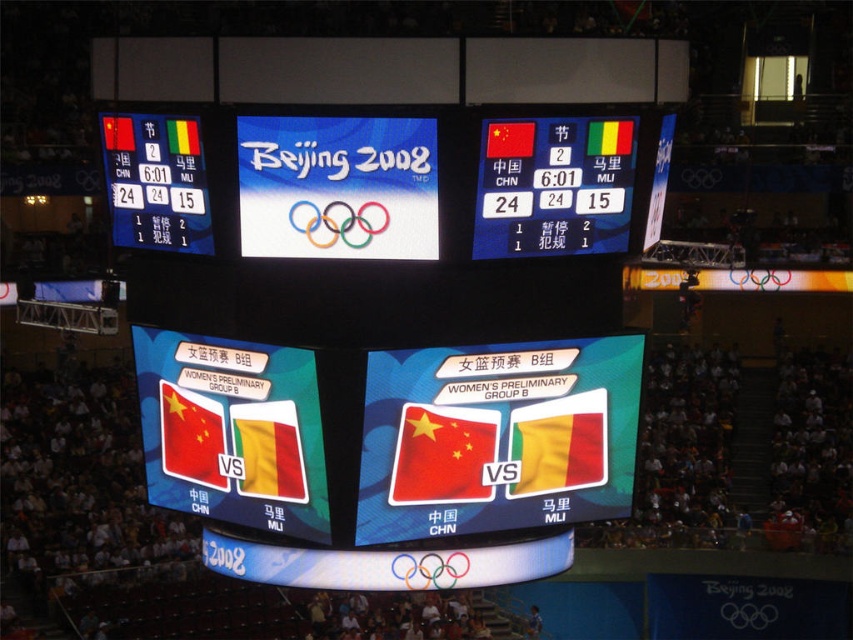
Question: Among these points, which one is farthest from the camera?

Choices:
 (A) (553, 445)
 (B) (239, 436)

Answer: (A)

Question: Based on their relative distances, which object is nearer to the red matte flag at lower left?

Choices:
 (A) red matte flag at center
 (B) yellow fabric flag at center
 (C) matte black scoreboard at upper left

Answer: (A)

Question: Does matte plastic scoreboard at upper center come in front of yellow fabric flag at center?

Choices:
 (A) no
 (B) yes

Answer: (B)

Question: Is white paper at center smaller than yellow fabric flag at center?

Choices:
 (A) yes
 (B) no

Answer: (A)

Question: Does matte plastic scoreboard at upper center appear on the right side of red fabric flag at center?

Choices:
 (A) no
 (B) yes

Answer: (B)

Question: Considering the real-world distances, which object is farthest from the matte plastic scoreboard at upper center?

Choices:
 (A) yellow fabric flag at center
 (B) white paper at center

Answer: (A)